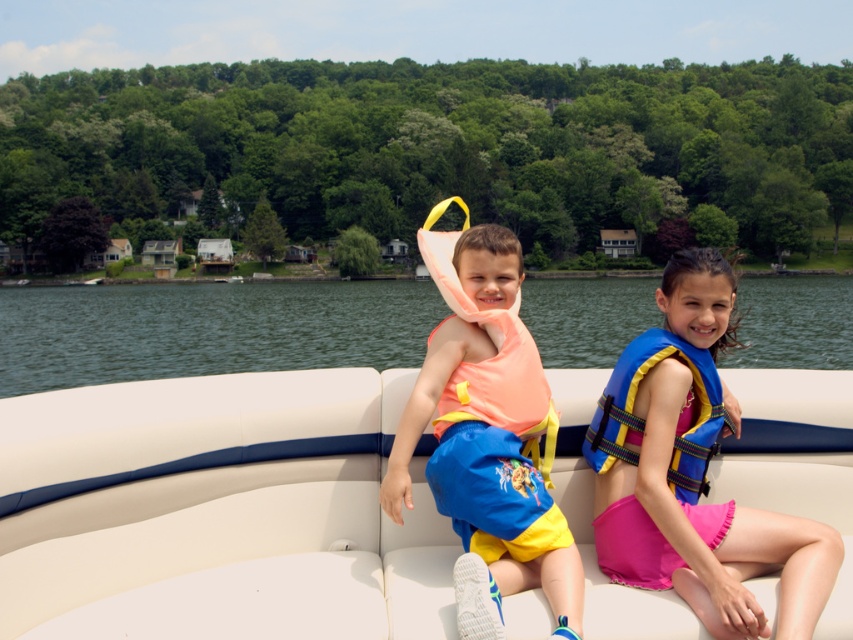
Who is more forward, [45,630] or [815,522]?

Point [45,630] is in front.

Which is more to the right, white vinyl boat at center or blue fabric life vest at center?

From the viewer's perspective, blue fabric life vest at center appears more on the right side.

This screenshot has width=853, height=640. Find the location of `white vinyl boat at center`. white vinyl boat at center is located at coordinates (218, 512).

This screenshot has height=640, width=853. Find the location of `white vinyl boat at center`. white vinyl boat at center is located at coordinates (218, 512).

Between matte orange life vest at center and blue/yellow striped life jacket at right, which one is positioned lower?

matte orange life vest at center

Does matte orange life vest at center come behind blue/yellow striped life jacket at right?

Yes, matte orange life vest at center is behind blue/yellow striped life jacket at right.

Between point (558, 572) and point (691, 372), which one is positioned in front?

Point (558, 572) is in front.

This screenshot has height=640, width=853. I want to click on matte orange life vest at center, so click(x=489, y=444).

What are the coordinates of `white vinyl boat at center` in the screenshot? It's located at [x=218, y=512].

You are a GUI agent. You are given a task and a screenshot of the screen. Output one action in this format:
    pyautogui.click(x=<x>, y=<y>)
    Task: Click on the white vinyl boat at center
    The height and width of the screenshot is (640, 853).
    Given the screenshot: What is the action you would take?
    pyautogui.click(x=218, y=512)